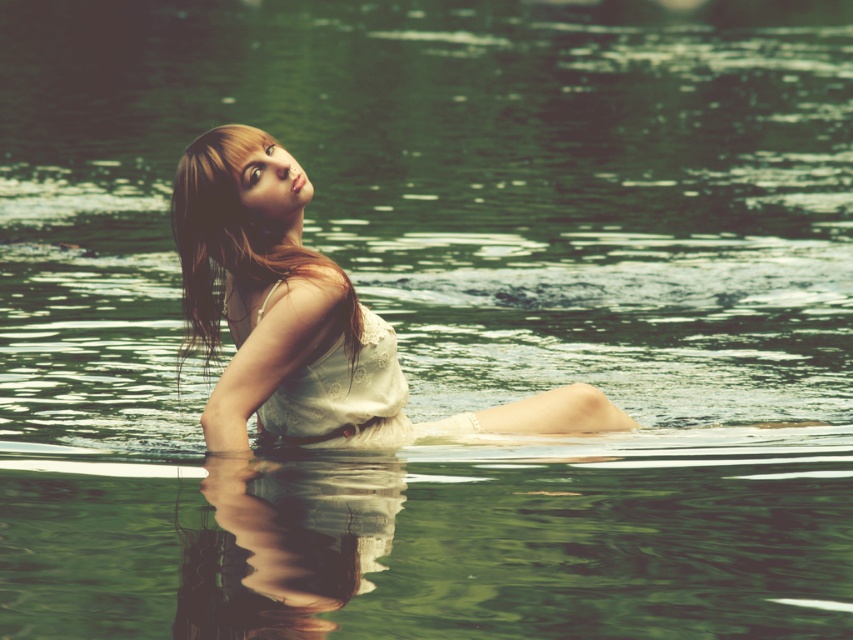
You are an observer looking at the serene scene. You notice two dresses at the center. Which one is closer to you, the matte white dress at center or the white lace dress at center?

The matte white dress at center is closer to the viewer than the white lace dress at center.

You are a photographer trying to capture the perfect shot of the person in the water. You notice a specific point in the image at coordinates point (306, 317). What object is located at this point?

The point (306, 317) indicates the location of the matte white dress at center.

You are a photographer trying to capture the scene. You need to ensure that the matte white dress at center and the brown shiny hair at upper left are both visible in your shot. Given that your camera has a fixed focus on the wider object, which object will be in focus?

The matte white dress at center will be in focus because its width is larger than the brown shiny hair at upper left, and the camera is focused on the wider object.